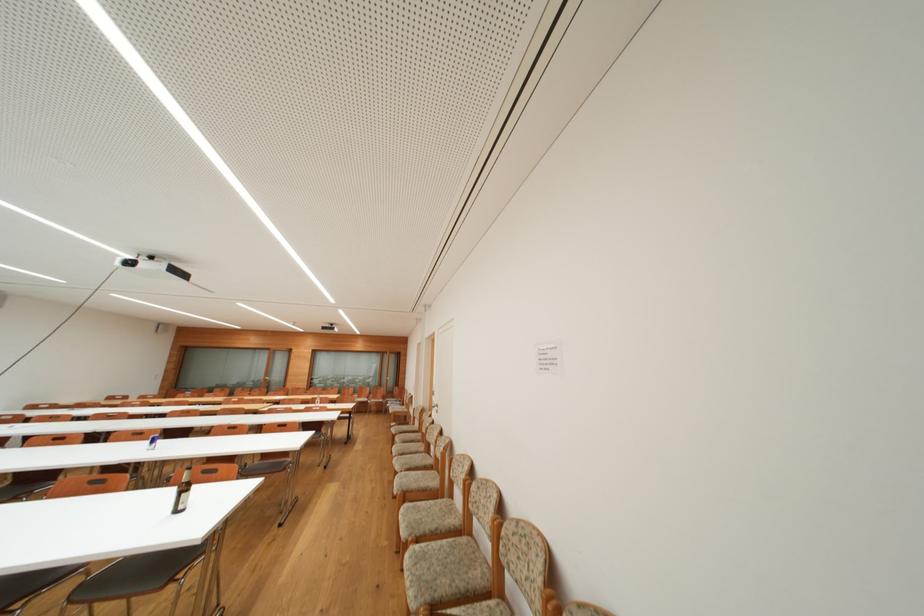
Find the location of a particular element. The image size is (924, 616). brown chair seat is located at coordinates [x=483, y=565].